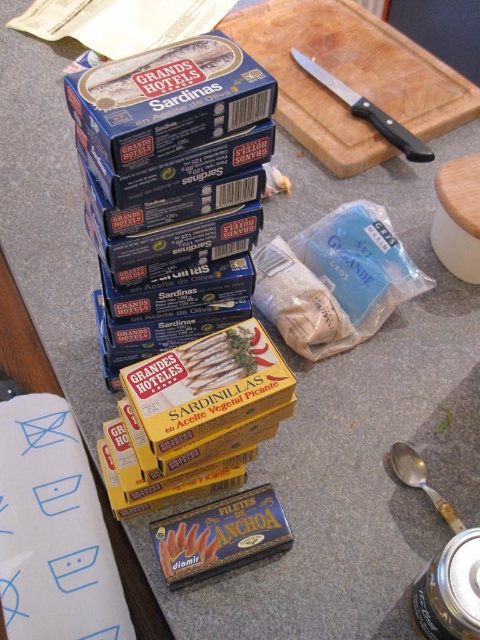
Can you confirm if blue cardboard box at upper center is positioned above orange matte fish at lower center?

Yes, blue cardboard box at upper center is above orange matte fish at lower center.

Does point (215, 60) come behind point (192, 532)?

No.

Identify the location of blue cardboard box at upper center. The image size is (480, 640). (169, 99).

Locate an element on the screen. The width and height of the screenshot is (480, 640). wooden cutting board at upper right is located at coordinates (349, 77).

Who is positioned more to the right, wooden cutting board at upper right or blue cardboard box at upper center?

wooden cutting board at upper right is more to the right.

Consider the image. Who is more forward, (382, 161) or (96, 76)?

Point (96, 76) is in front.

Find the location of a particular element. wooden cutting board at upper right is located at coordinates (349, 77).

Is wooden cutting board at upper right further to camera compared to orange matte fish at lower center?

Yes, it is.

Does wooden cutting board at upper right have a larger size compared to orange matte fish at lower center?

Indeed, wooden cutting board at upper right has a larger size compared to orange matte fish at lower center.

Is point (280, 38) positioned before point (180, 570)?

No, it is behind (180, 570).

Identify the location of wooden cutting board at upper right. (349, 77).